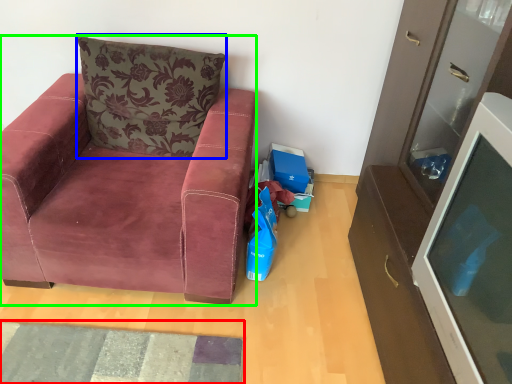
Question: Estimate the real-world distances between objects in this image. Which object is closer to mat (highlighted by a red box), pillow (highlighted by a blue box) or chair (highlighted by a green box)?

Choices:
 (A) pillow
 (B) chair

Answer: (B)